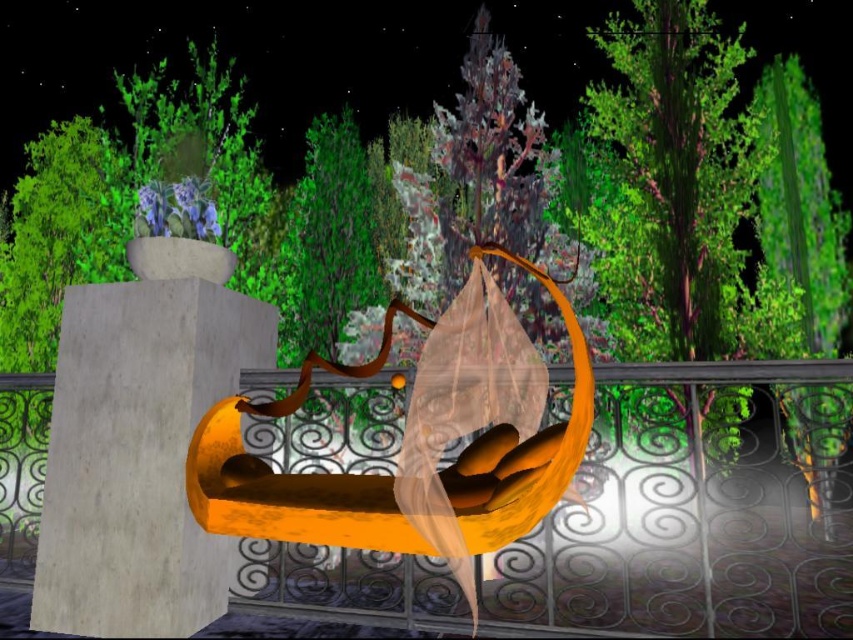
Question: Can you confirm if concrete block at center is positioned to the left of orange matte bench at center?

Choices:
 (A) no
 (B) yes

Answer: (B)

Question: Is concrete block at center to the left of orange matte bench at center from the viewer's perspective?

Choices:
 (A) yes
 (B) no

Answer: (A)

Question: Among these points, which one is nearest to the camera?

Choices:
 (A) (569, 436)
 (B) (595, 438)

Answer: (A)

Question: Does metallic wrought iron at center appear on the left side of concrete block at center?

Choices:
 (A) no
 (B) yes

Answer: (A)

Question: Which object is farther from the camera taking this photo?

Choices:
 (A) orange matte bench at center
 (B) metallic wrought iron at center

Answer: (B)

Question: Which object is the farthest from the orange matte bench at center?

Choices:
 (A) metallic wrought iron at center
 (B) concrete block at center

Answer: (A)